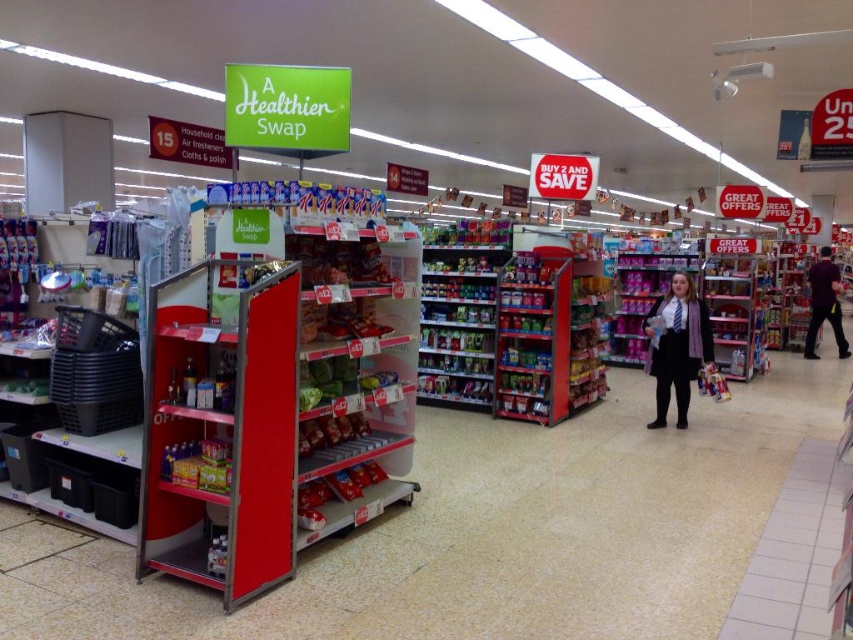
You are a customer in the store and want to pick up both the red plastic shelf at center and the purple fabric shirt at right. Which item should you move towards first if you are standing to the left of both items?

You should move towards the red plastic shelf at center first because it is positioned on the left side of the purple fabric shirt at right, making it closer to your current position on the left.